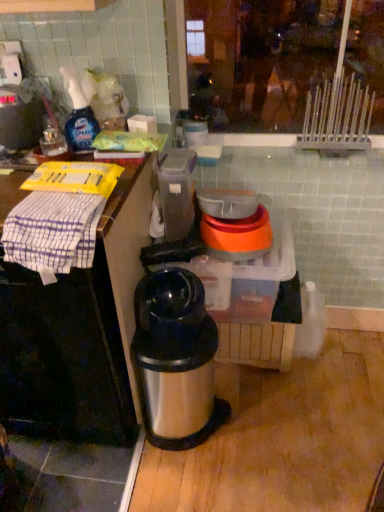
Question: Is stainless steel thermos at center shorter than clear plastic spray bottle at upper left?

Choices:
 (A) no
 (B) yes

Answer: (A)

Question: From a real-world perspective, is stainless steel thermos at center under clear plastic spray bottle at upper left?

Choices:
 (A) no
 (B) yes

Answer: (B)

Question: Is stainless steel thermos at center not inside clear plastic spray bottle at upper left?

Choices:
 (A) yes
 (B) no

Answer: (A)

Question: Is stainless steel thermos at center at the right side of clear plastic spray bottle at upper left?

Choices:
 (A) yes
 (B) no

Answer: (A)

Question: Is stainless steel thermos at center in front of clear plastic spray bottle at upper left?

Choices:
 (A) no
 (B) yes

Answer: (B)

Question: In terms of width, does orange plastic bowl at center, which is the 2th appliance in left-to-right order, look wider or thinner when compared to white checkered cloth at left?

Choices:
 (A) thin
 (B) wide

Answer: (B)

Question: Is orange plastic bowl at center, which is the 1th appliance from right to left, in front of or behind white checkered cloth at left in the image?

Choices:
 (A) front
 (B) behind

Answer: (B)

Question: Is point (256, 244) positioned closer to the camera than point (81, 212)?

Choices:
 (A) closer
 (B) farther

Answer: (B)

Question: Based on their positions, is orange plastic bowl at center, which is the 2th appliance in left-to-right order, located to the left or right of white checkered cloth at left?

Choices:
 (A) left
 (B) right

Answer: (B)

Question: Does point (84, 105) appear closer or farther from the camera than point (46, 206)?

Choices:
 (A) farther
 (B) closer

Answer: (A)

Question: From the image's perspective, relative to white checkered cloth at left, is clear plastic spray bottle at upper left above or below?

Choices:
 (A) above
 (B) below

Answer: (A)

Question: In terms of size, does clear plastic spray bottle at upper left appear bigger or smaller than white checkered cloth at left?

Choices:
 (A) small
 (B) big

Answer: (A)

Question: From a real-world perspective, relative to white checkered cloth at left, is clear plastic spray bottle at upper left vertically above or below?

Choices:
 (A) above
 (B) below

Answer: (A)

Question: Would you say orange plastic bowl at center, which is the 1th appliance from right to left, is inside or outside white checkered cloth at left?

Choices:
 (A) outside
 (B) inside

Answer: (A)

Question: Considering their positions, is orange plastic bowl at center, which is the 2th appliance in left-to-right order, located in front of or behind white checkered cloth at left?

Choices:
 (A) behind
 (B) front

Answer: (A)